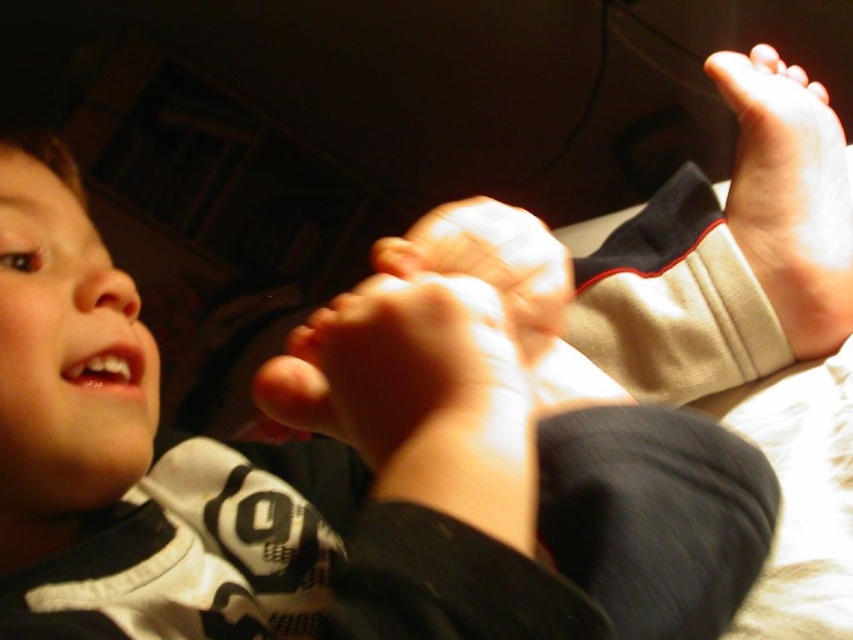
Question: Does smooth skin feet at upper center have a larger size compared to pink soft skin at upper center?

Choices:
 (A) no
 (B) yes

Answer: (B)

Question: Among these points, which one is farthest from the camera?

Choices:
 (A) (809, 124)
 (B) (387, 410)
 (C) (811, 84)

Answer: (C)

Question: Which object is the farthest from the pink soft skin at upper center?

Choices:
 (A) smooth skin feet at upper center
 (B) smooth skin hand at center

Answer: (A)

Question: Can you confirm if smooth beige sock at upper right is positioned to the right of pink soft skin at upper center?

Choices:
 (A) no
 (B) yes

Answer: (A)

Question: Estimate the real-world distances between objects in this image. Which object is closer to the smooth beige sock at upper right?

Choices:
 (A) smooth skin hand at center
 (B) smooth skin feet at upper center

Answer: (A)

Question: Can you confirm if smooth skin hand at center is thinner than pink soft skin at upper center?

Choices:
 (A) no
 (B) yes

Answer: (A)